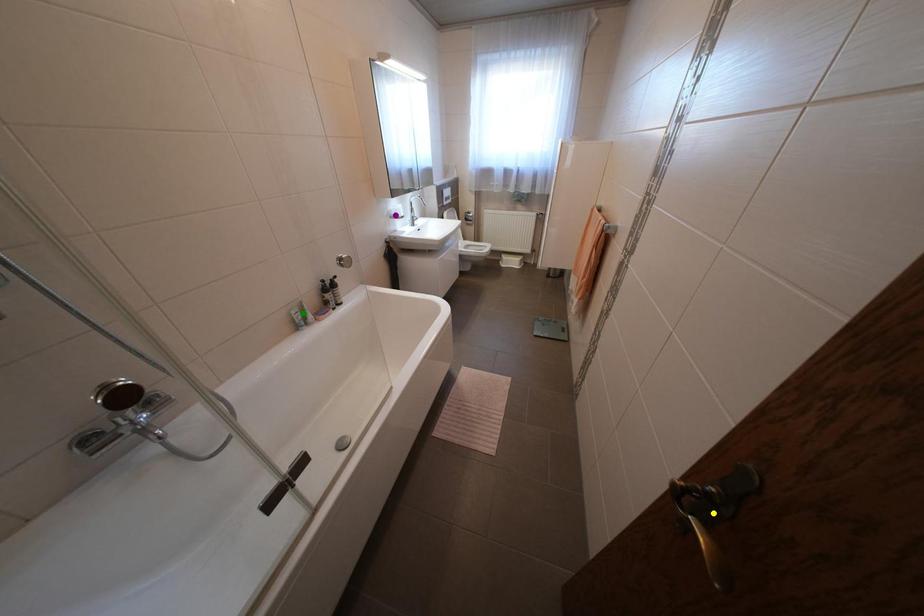
Order these from nearest to farthest:
green point | purple point | yellow point

1. yellow point
2. green point
3. purple point